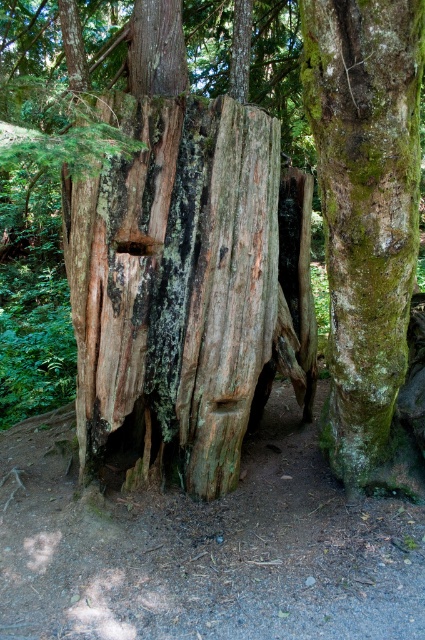
Based on the photo, who is positioned more to the left, smooth brown wood at center or smooth wood hole at center?

smooth brown wood at center is more to the left.

Does point (136, 237) come behind point (221, 401)?

No, (136, 237) is closer to viewer.

At what (x,y) coordinates should I click in order to perform the action: click on smooth brown wood at center. Please return your answer as a coordinate pair (x, y). Looking at the image, I should click on (136, 246).

Between green mossy bark at center and smooth wood hole at center, which one has more height?

green mossy bark at center

Is point (343, 76) positioned before point (224, 397)?

Yes, point (343, 76) is closer to viewer.

Locate an element on the screen. This screenshot has width=425, height=640. green mossy bark at center is located at coordinates (365, 205).

Does green mossy bark at center have a greater width compared to smooth brown wood at center?

Indeed, green mossy bark at center has a greater width compared to smooth brown wood at center.

Is point (368, 99) less distant than point (135, 244)?

Yes.

Identify the location of green mossy bark at center. (365, 205).